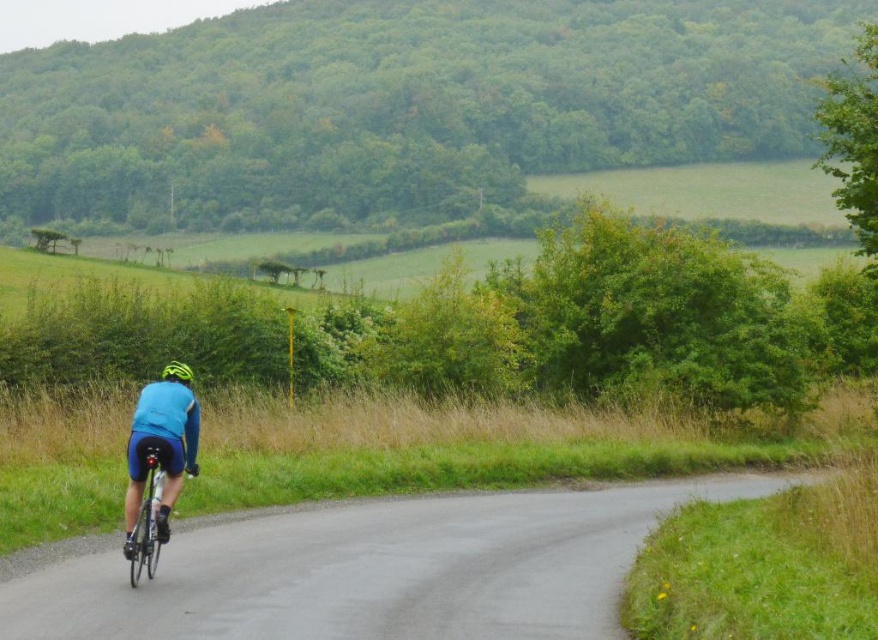
How far apart are green leafy hill at upper center and shiny metallic bicycle at center?

green leafy hill at upper center and shiny metallic bicycle at center are 90.55 meters apart from each other.

Who is higher up, green leafy hill at upper center or shiny metallic bicycle at center?

green leafy hill at upper center is above.

Between point (286, 115) and point (130, 557), which one is positioned in front?

Positioned in front is point (130, 557).

At what (x,y) coordinates should I click in order to perform the action: click on green leafy hill at upper center. Please return your answer as a coordinate pair (x, y). The height and width of the screenshot is (640, 878). Looking at the image, I should click on (401, 106).

Is shiny metallic bicycle at center bigger than green matte helmet at center?

Actually, shiny metallic bicycle at center might be smaller than green matte helmet at center.

Based on the photo, can you confirm if shiny metallic bicycle at center is thinner than green matte helmet at center?

Yes, shiny metallic bicycle at center is thinner than green matte helmet at center.

Image resolution: width=878 pixels, height=640 pixels. Describe the element at coordinates (149, 508) in the screenshot. I see `shiny metallic bicycle at center` at that location.

The height and width of the screenshot is (640, 878). What are the coordinates of `shiny metallic bicycle at center` in the screenshot? It's located at (149, 508).

Between blue fabric cyclist at center and green matte helmet at center, which one is positioned lower?

blue fabric cyclist at center

Does blue fabric cyclist at center appear on the left side of green matte helmet at center?

In fact, blue fabric cyclist at center is to the right of green matte helmet at center.

Is point (180, 428) closer to camera compared to point (180, 376)?

That is True.

Identify the location of blue fabric cyclist at center. The image size is (878, 640). (160, 451).